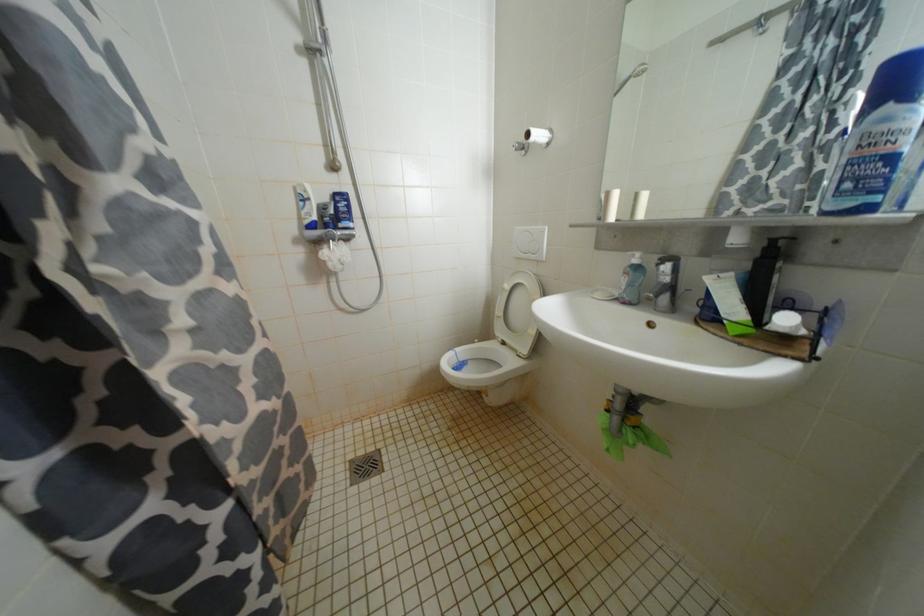
What do you see at coordinates (663, 267) in the screenshot?
I see `the sink faucet lever` at bounding box center [663, 267].